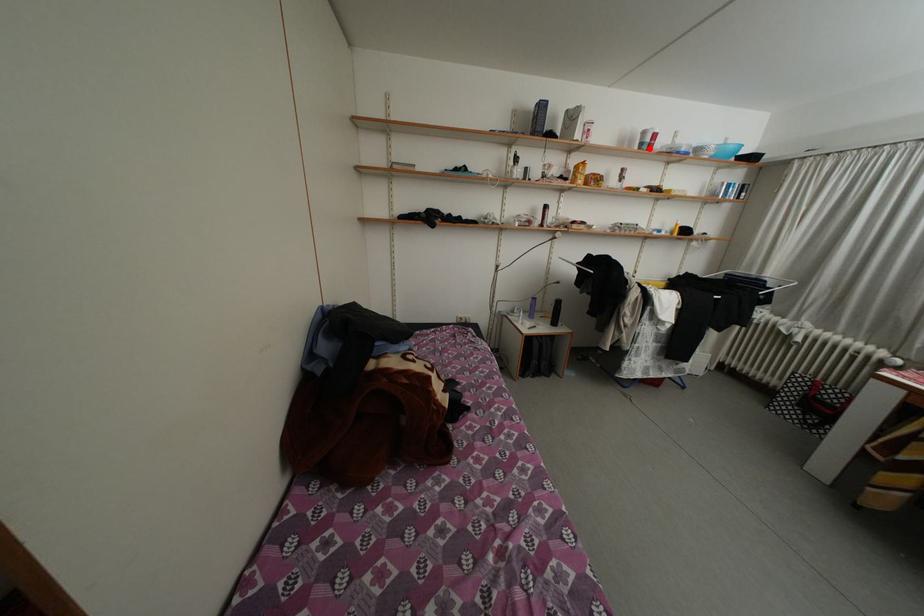
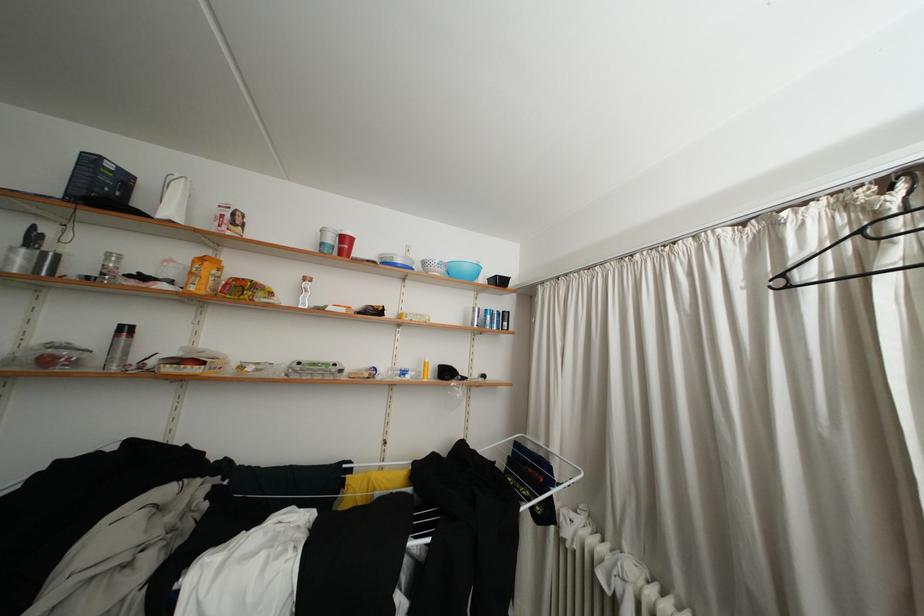
Find the pixel in the second image that matches the highlighted location in the first image.

(330, 249)